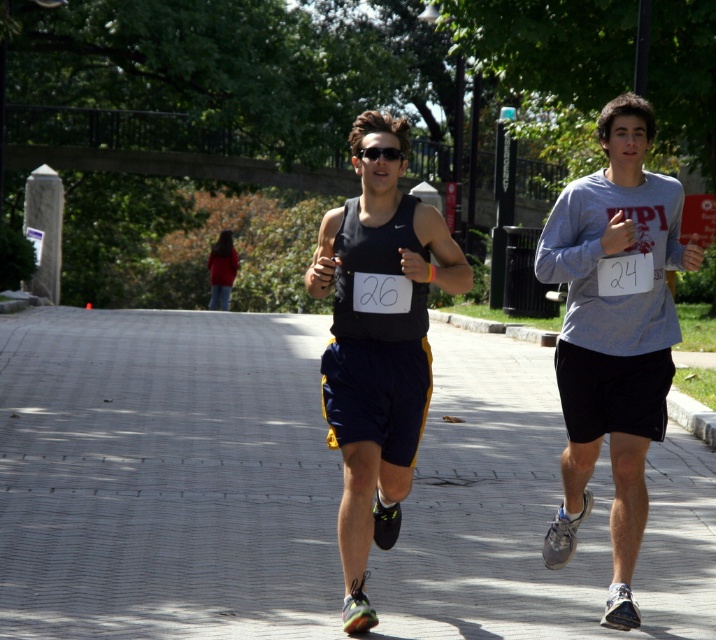
Is point (634, 472) positioned behind point (217, 262)?

No, it is not.

Between gray cotton shirt at right and red fleece jacket at center, which one is positioned lower?

gray cotton shirt at right is lower down.

Which is behind, point (551, 256) or point (213, 285)?

Point (213, 285)

The width and height of the screenshot is (716, 640). Identify the location of gray cotton shirt at right. click(614, 333).

Image resolution: width=716 pixels, height=640 pixels. I want to click on gray brick pavement at center, so click(165, 476).

Which is more to the left, gray brick pavement at center or red fleece jacket at center?

Positioned to the left is red fleece jacket at center.

Which is above, gray brick pavement at center or red fleece jacket at center?

Positioned higher is red fleece jacket at center.

Is point (495, 420) positioned after point (228, 230)?

No, (495, 420) is closer to viewer.

In order to click on gray brick pavement at center in this screenshot , I will do `click(165, 476)`.